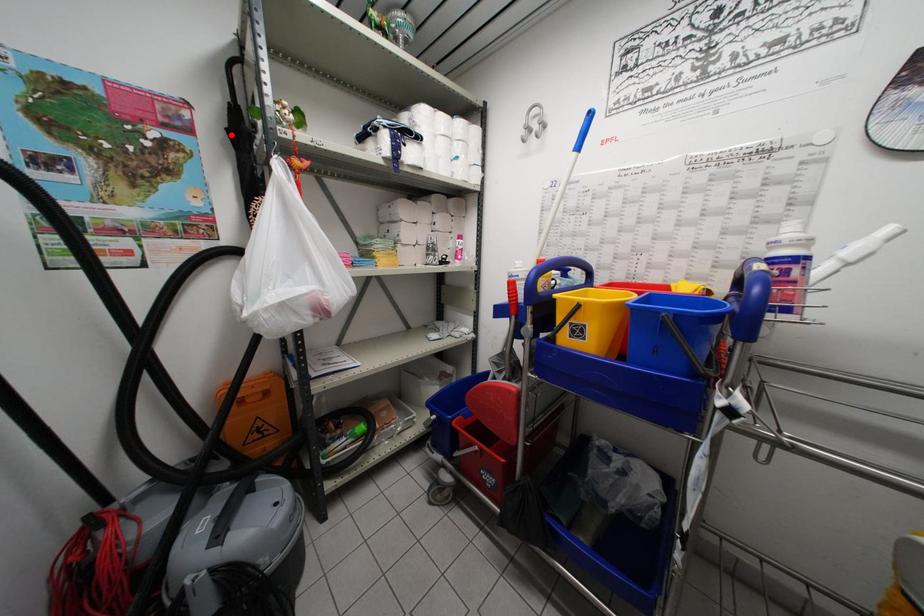
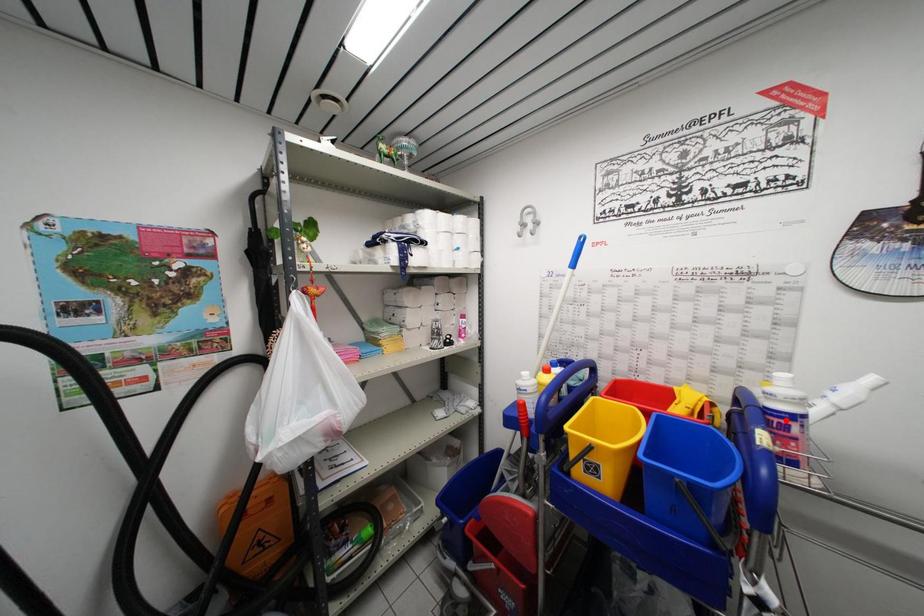
I am providing you with two images of the same scene from different viewpoints. A red point is marked on the first image and another point is marked on the second image. Do the highlighted points in image1 and image2 indicate the same real-world spot?

No